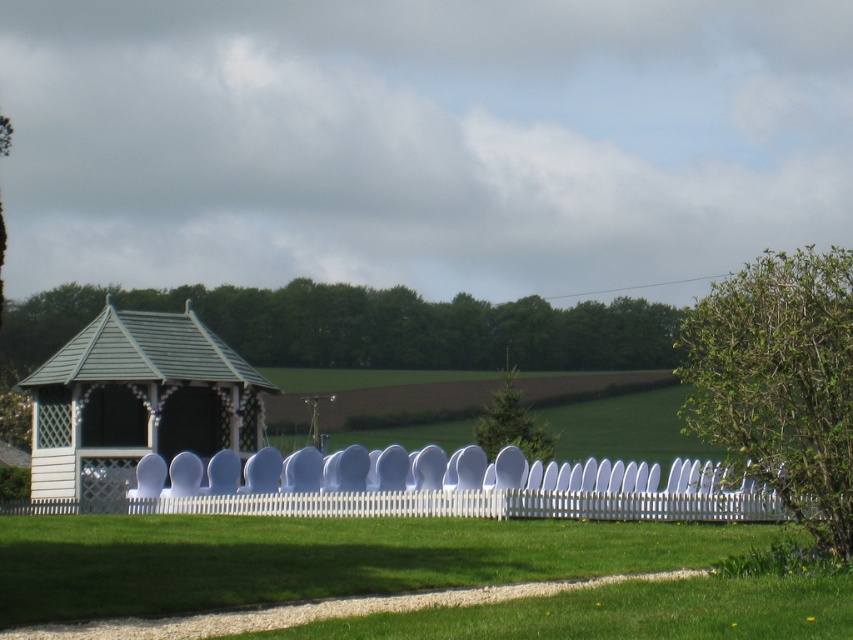
Question: Does white picket fence at center appear over white wood gazebo at left?

Choices:
 (A) no
 (B) yes

Answer: (B)

Question: Which object is closer to the camera taking this photo?

Choices:
 (A) green grass at lower center
 (B) white picket fence at center

Answer: (A)

Question: Among these points, which one is farthest from the camera?

Choices:
 (A) (395, 474)
 (B) (688, 620)

Answer: (A)

Question: Which point is farther to the camera?

Choices:
 (A) (759, 625)
 (B) (38, 381)

Answer: (B)

Question: In this image, where is green grass at lower center located relative to white picket fence at center?

Choices:
 (A) left
 (B) right

Answer: (A)

Question: Is green grass at lower center behind white wood gazebo at left?

Choices:
 (A) yes
 (B) no

Answer: (B)